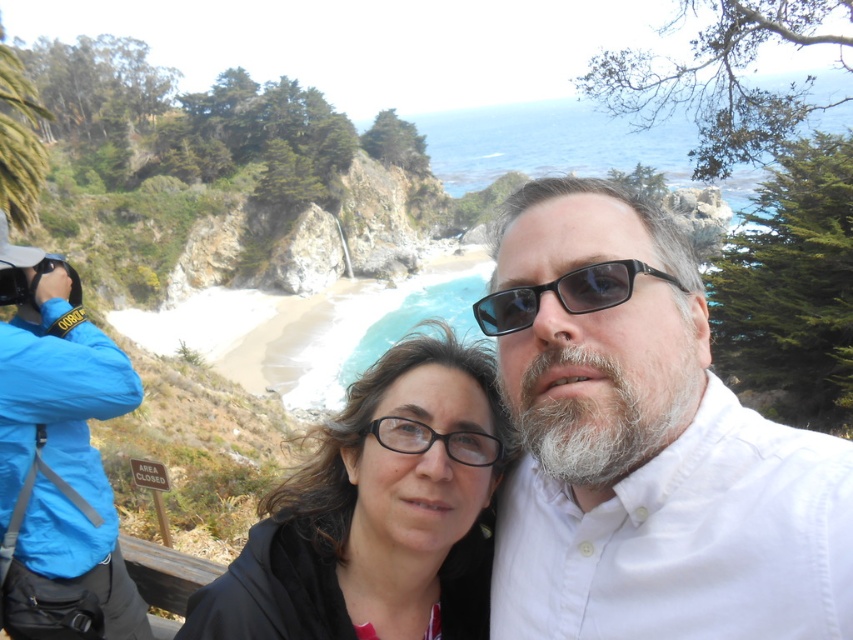
You are a photographer trying to capture a closeup shot of the black matte hair at center and the black plastic sunglasses at center. Given that your camera can only focus on objects within a 15 feet range, will you be able to capture both subjects in focus?

The distance between the black matte hair at center and the black plastic sunglasses at center is 17.51 feet, which exceeds the camera focus range of 15 feet. Therefore, you cannot capture both subjects in focus simultaneously.

You are a photographer trying to capture a photo of the coastal landscape. You notice two clothing items in the scene, the white cotton shirt at center and the blue fabric jacket at left. Which clothing item appears shorter in the image?

The white cotton shirt at center appears shorter than the blue fabric jacket at left in the image.